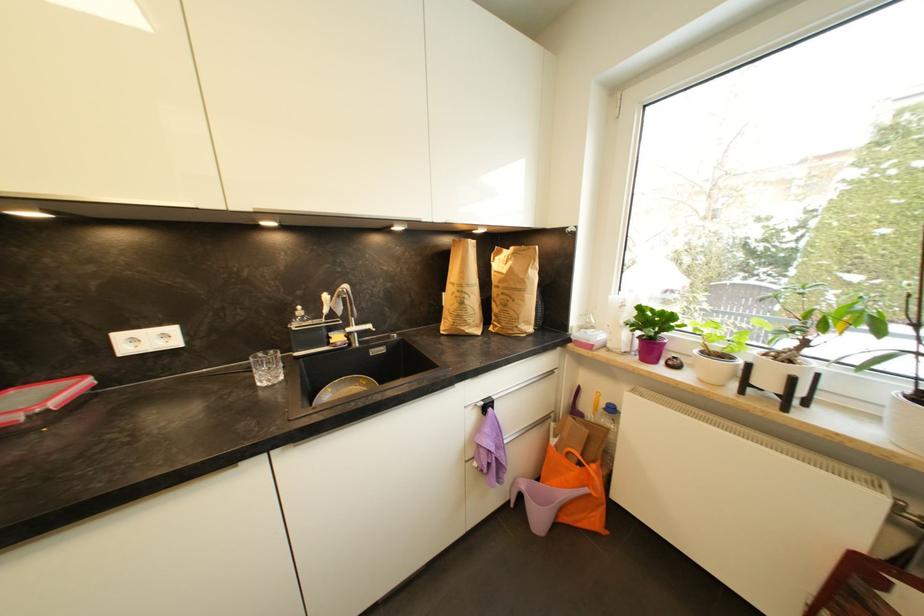
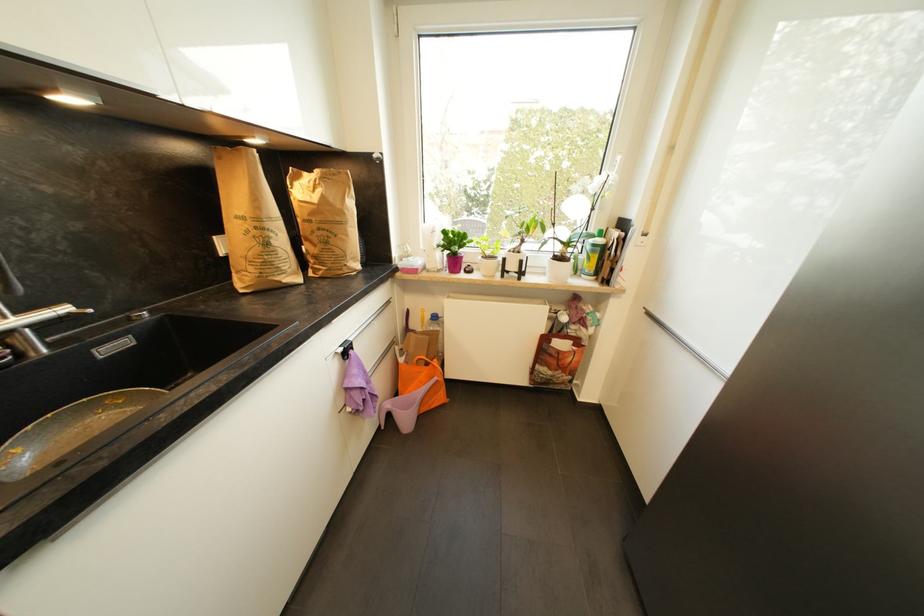
In the second image, find the point that corresponds to point (505, 284) in the first image.

(317, 216)